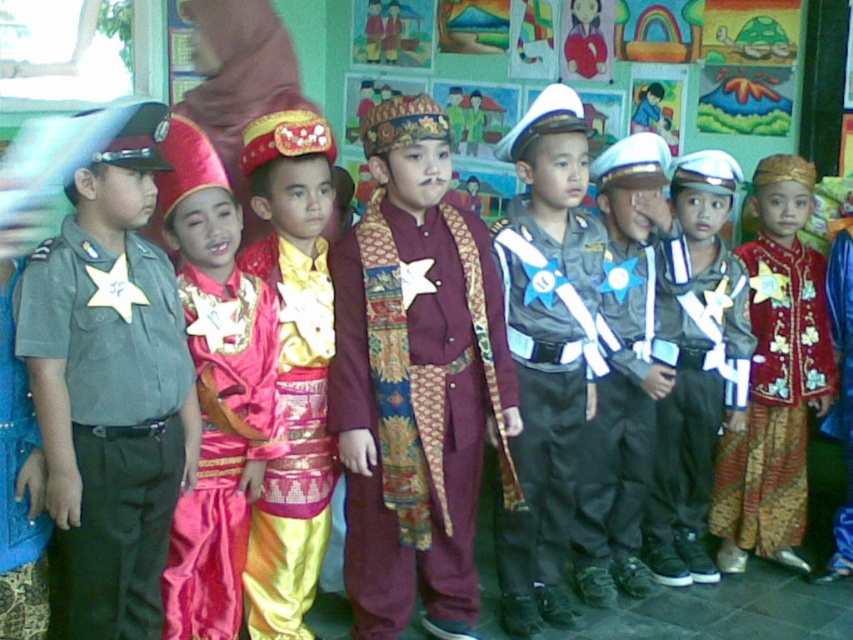
Question: Which point is closer to the camera?

Choices:
 (A) (277, 250)
 (B) (601, 269)

Answer: (A)

Question: Which object is closer to the camera taking this photo?

Choices:
 (A) red satin robe at center
 (B) shiny silver uniform at center
 (C) matte gray uniform at left
 (D) shiny red fabric costume at center

Answer: (C)

Question: Does maroon satin robe at center have a larger size compared to shiny pink fabric at center?

Choices:
 (A) no
 (B) yes

Answer: (B)

Question: Can you confirm if matte gray uniform at left is bigger than shiny red fabric costume at center?

Choices:
 (A) yes
 (B) no

Answer: (A)

Question: Which object appears farthest from the camera in this image?

Choices:
 (A) matte black uniform at center
 (B) shiny silver uniform at center
 (C) matte gray uniform at left
 (D) maroon satin robe at center

Answer: (A)

Question: Is matte gray uniform at left positioned at the back of shiny red fabric costume at center?

Choices:
 (A) yes
 (B) no

Answer: (B)